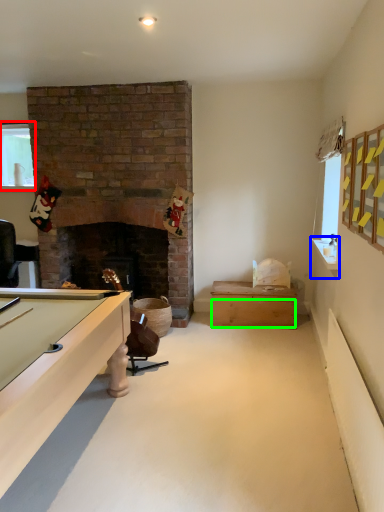
Question: Considering the real-world distances, which object is closest to window (highlighted by a red box)? counter top (highlighted by a blue box) or drawer (highlighted by a green box).

Choices:
 (A) counter top
 (B) drawer

Answer: (B)